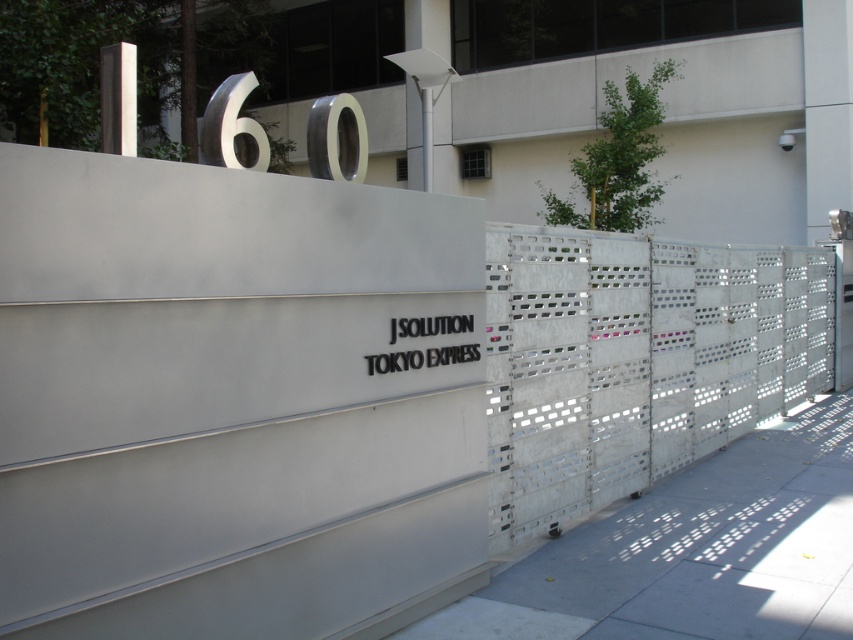
You are standing in front of the building facade and want to know how far the point at coordinates [550,280] is from you. Can you determine the distance in feet?

The point at coordinates [550,280] is 16.46 feet away from the viewer.

You are standing in front of the building facade described. You need to locate the metallic perforated fence at right. Based on the coordinates provided, where exactly is it positioned relative to the wall?

The metallic perforated fence at right is positioned at coordinates point [613,365] relative to the wall.